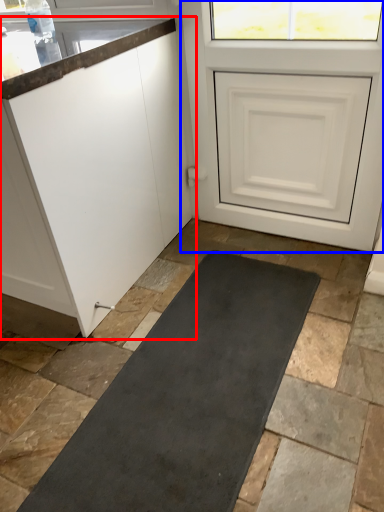
Question: Which of the following is the closest to the observer, cabinetry (highlighted by a red box) or door (highlighted by a blue box)?

Choices:
 (A) cabinetry
 (B) door

Answer: (A)